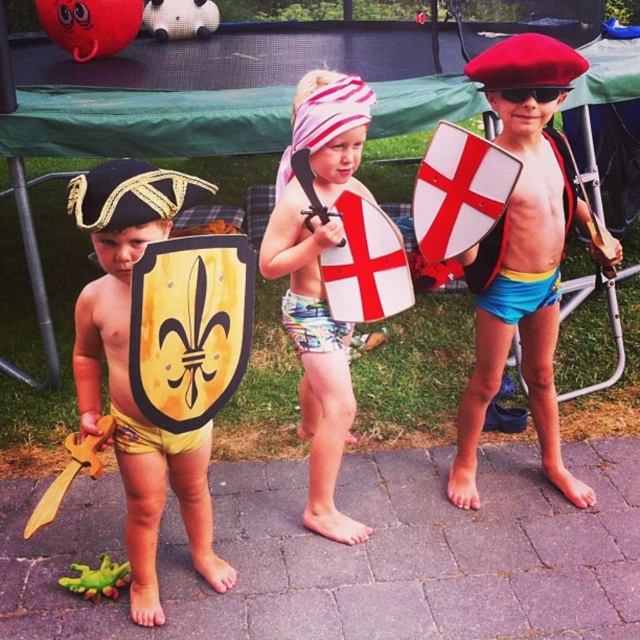
You are a parent trying to ensure your children are safe while playing with their shields and diapers. Given the scene described, which object between the matte yellow shield at center and the yellow printed diaper at center is taller?

The matte yellow shield at center is taller than the yellow printed diaper at center according to the description.

You are a photographer trying to capture a shot of the three children. You notice a point at coordinates [524,259] in the image. What object is located at this point?

The point at coordinates [524,259] corresponds to the red matte beret at upper right.

You are a parent trying to organize your childrens toys. You have a small storage box that can only fit items smaller than the yellow printed diaper at center. Can the matte yellow shield at center be stored in this box?

The matte yellow shield at center is larger in size than the yellow printed diaper at center, so it cannot be stored in the box designed for items smaller than the yellow printed diaper at center.